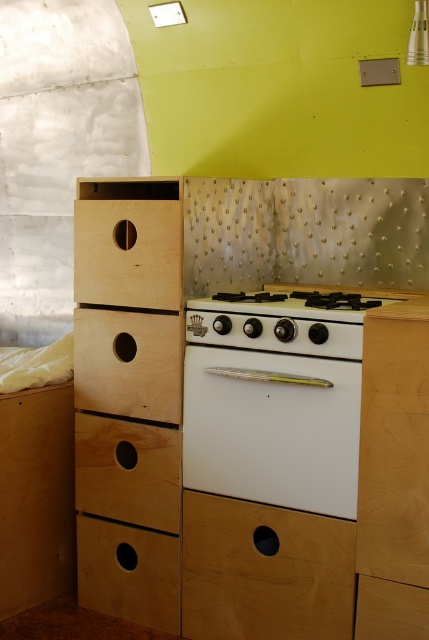
Question: Can you confirm if white glossy oven at center is positioned above light brown wood drawer at lower left?

Choices:
 (A) yes
 (B) no

Answer: (A)

Question: Which point is farther from the camera taking this photo?

Choices:
 (A) (148, 349)
 (B) (259, 417)

Answer: (A)

Question: Is the position of white glossy oven at center less distant than that of light brown wood drawer at lower left?

Choices:
 (A) yes
 (B) no

Answer: (A)

Question: Estimate the real-world distances between objects in this image. Which object is farther from the light wood drawer at lower left?

Choices:
 (A) light brown wood drawer at center
 (B) light brown wood drawer at lower right
 (C) bare wood drawer at left

Answer: (C)

Question: Among these points, which one is nearest to the camera?

Choices:
 (A) (413, 632)
 (B) (144, 497)

Answer: (A)

Question: Can you confirm if bare wood drawer at left is positioned to the right of light brown wood drawer at lower left?

Choices:
 (A) no
 (B) yes

Answer: (B)